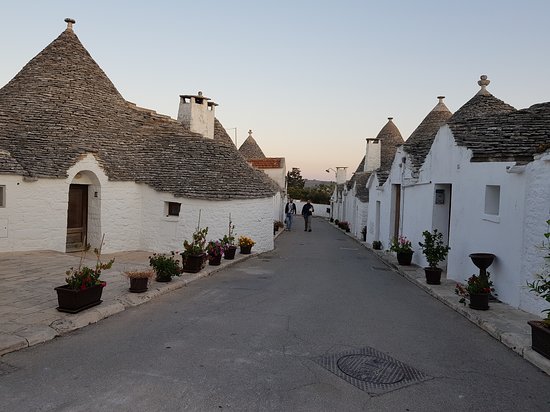
Identify the location of entry. This screenshot has height=412, width=550. (82, 221), (443, 216), (397, 209), (376, 216), (354, 218), (343, 210), (330, 210).